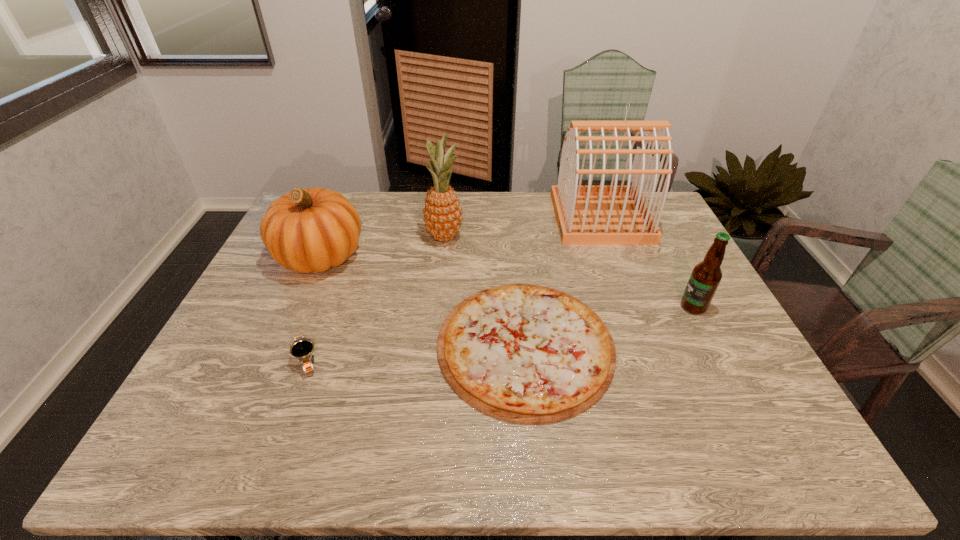
This screenshot has width=960, height=540. I want to click on birdcage, so click(x=586, y=215).

Identify the location of pineapple. (442, 214).

At what (x,y) coordinates should I click in order to perform the action: click on pumpkin. Please return your answer as a coordinate pair (x, y). The height and width of the screenshot is (540, 960). Looking at the image, I should click on (306, 230).

Identify the location of beer bottle. (705, 278).

Find the location of a particular element. Image resolution: width=960 pixels, height=540 pixels. the fifth tallest object is located at coordinates (302, 349).

Locate an element on the screen. This screenshot has width=960, height=540. pizza is located at coordinates (523, 353).

Where is `vacant space located with an open door on the birdcage`? The image size is (960, 540). vacant space located with an open door on the birdcage is located at coordinates (442, 218).

Identify the location of free region located with an open door on the birdcage. (515, 218).

This screenshot has height=540, width=960. Identify the location of free space located 0.330m with an open door on the birdcage. (459, 218).

The image size is (960, 540). Find the location of `vacant space located on the right of the second tallest object`. vacant space located on the right of the second tallest object is located at coordinates (516, 238).